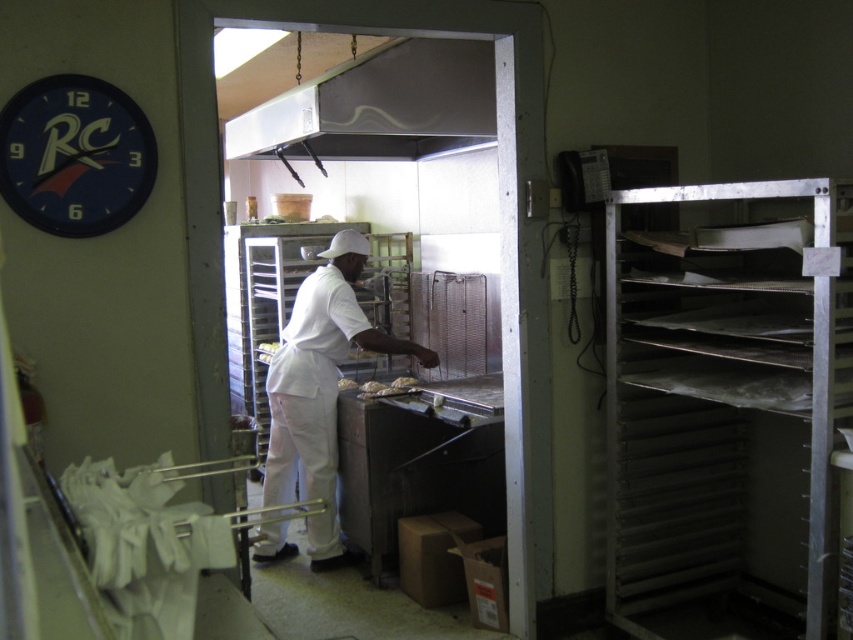
You are a customer entering the bakery through the doorway. You see the metallic at upper center and the white matte uniform at center. Which object is positioned higher in the scene?

The metallic at upper center is positioned higher than the white matte uniform at center.

You are standing in the bakery and need to reach the clock on the wall. There is a white matte uniform at center in your way. Can you move around it to get to the clock?

The white matte uniform at center is located at point (320, 390), so yes, you can move around it to reach the clock on the wall.